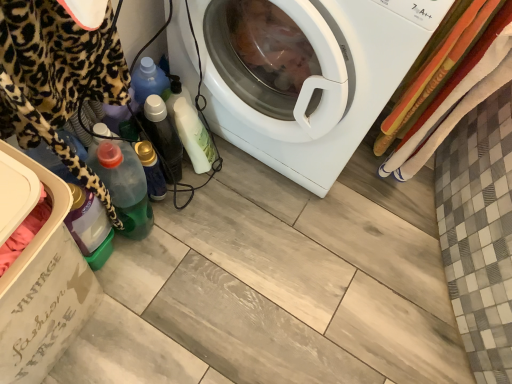
Question: Does transparent plastic dish washer at lower left appear on the left side of white glossy washing machine at center?

Choices:
 (A) no
 (B) yes

Answer: (B)

Question: Is transparent plastic dish washer at lower left taller than white glossy washing machine at center?

Choices:
 (A) no
 (B) yes

Answer: (A)

Question: Is transparent plastic dish washer at lower left next to white glossy washing machine at center and touching it?

Choices:
 (A) no
 (B) yes

Answer: (A)

Question: Is transparent plastic dish washer at lower left not inside white glossy washing machine at center?

Choices:
 (A) no
 (B) yes

Answer: (B)

Question: From a real-world perspective, is transparent plastic dish washer at lower left located higher than white glossy washing machine at center?

Choices:
 (A) no
 (B) yes

Answer: (A)

Question: Does transparent plastic dish washer at lower left have a lesser width compared to white glossy washing machine at center?

Choices:
 (A) yes
 (B) no

Answer: (A)

Question: Is white glossy bottle at center, which appears as the third bottle when ordered from the bottom, inside translucent plastic bottle at lower left, arranged as the third bottle when viewed from the top?

Choices:
 (A) yes
 (B) no

Answer: (B)

Question: Are translucent plastic bottle at lower left, which is the first bottle in bottom-to-top order, and white glossy bottle at center, which appears as the third bottle when ordered from the bottom, beside each other?

Choices:
 (A) yes
 (B) no

Answer: (B)

Question: Is translucent plastic bottle at lower left, which is the first bottle in bottom-to-top order, to the right of white glossy bottle at center, placed as the 1th bottle when sorted from top to bottom, from the viewer's perspective?

Choices:
 (A) yes
 (B) no

Answer: (B)

Question: Is the position of translucent plastic bottle at lower left, which is the first bottle in bottom-to-top order, less distant than that of white glossy bottle at center, placed as the 1th bottle when sorted from top to bottom?

Choices:
 (A) yes
 (B) no

Answer: (A)

Question: From the image's perspective, does translucent plastic bottle at lower left, which is the first bottle in bottom-to-top order, appear lower than white glossy bottle at center, placed as the 1th bottle when sorted from top to bottom?

Choices:
 (A) no
 (B) yes

Answer: (B)

Question: Can you confirm if translucent plastic bottle at lower left, which is the first bottle in bottom-to-top order, is taller than white glossy bottle at center, which appears as the third bottle when ordered from the bottom?

Choices:
 (A) no
 (B) yes

Answer: (B)

Question: Is translucent plastic bottle at lower left, arranged as the third bottle when viewed from the top, surrounding transparent plastic dish washer at lower left?

Choices:
 (A) yes
 (B) no

Answer: (B)